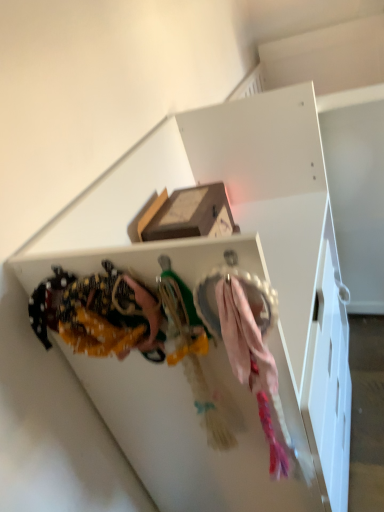
Based on the photo, in order to face cardboard box at upper center, should I rotate leftwards or rightwards?

You should rotate left by 0.148 degrees.

The height and width of the screenshot is (512, 384). Describe the element at coordinates (187, 214) in the screenshot. I see `cardboard box at upper center` at that location.

The image size is (384, 512). Find the location of `cardboard box at upper center`. cardboard box at upper center is located at coordinates (187, 214).

Identify the location of cardboard box at upper center. coord(187,214).